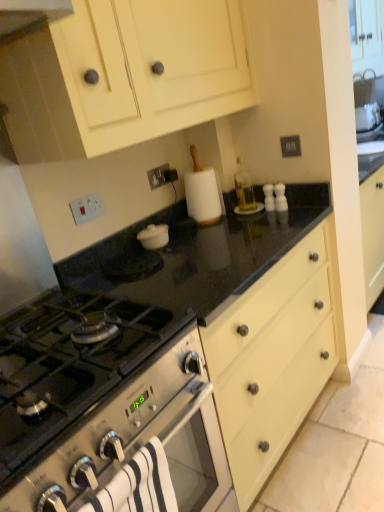
Question: Relative to black granite countertop at center, is white striped towel at lower left in front or behind?

Choices:
 (A) behind
 (B) front

Answer: (B)

Question: Choose the correct answer: Is white striped towel at lower left inside black granite countertop at center or outside it?

Choices:
 (A) inside
 (B) outside

Answer: (B)

Question: Estimate the real-world distances between objects in this image. Which object is farther from the white striped towel at lower left?

Choices:
 (A) stainless steel gas stove at lower left
 (B) black granite countertop at center
 (C) matte cream cabinet at upper center

Answer: (C)

Question: Based on their relative distances, which object is nearer to the stainless steel gas stove at lower left?

Choices:
 (A) white striped towel at lower left
 (B) matte cream cabinet at upper center
 (C) black granite countertop at center

Answer: (C)